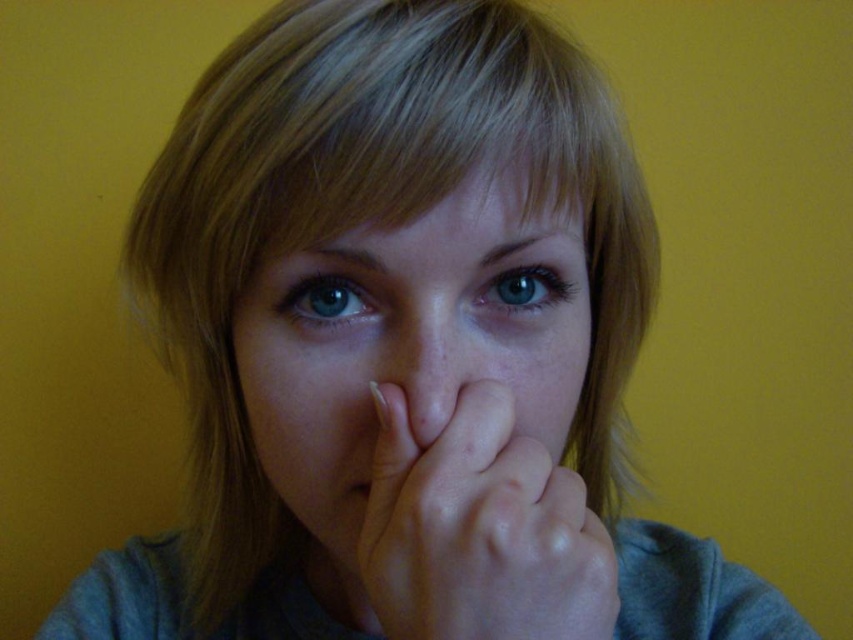
Which is in front, point (392, 333) or point (299, 320)?

Point (392, 333)

From the picture: Can you confirm if smooth skin nose at center is taller than blue glossy eye at center?

Yes.

Which is behind, point (413, 307) or point (279, 312)?

The point (279, 312) is more distant.

Locate an element on the screen. This screenshot has width=853, height=640. smooth skin nose at center is located at coordinates (421, 365).

Is blue matte eye at center in front of matte skin at center?

No, blue matte eye at center is further to the viewer.

In the scene shown: Does blue matte eye at center come behind matte skin at center?

Yes.

This screenshot has width=853, height=640. Find the location of `blue matte eye at center`. blue matte eye at center is located at coordinates (523, 289).

You are a GUI agent. You are given a task and a screenshot of the screen. Output one action in this format:
    pyautogui.click(x=<x>, y=<y>)
    Task: Click on the blue matte eye at center
    
    Given the screenshot: What is the action you would take?
    pyautogui.click(x=523, y=289)

Which is above, smooth skin hand at center or smooth skin nose at center?

smooth skin nose at center is above.

This screenshot has height=640, width=853. I want to click on smooth skin hand at center, so click(479, 529).